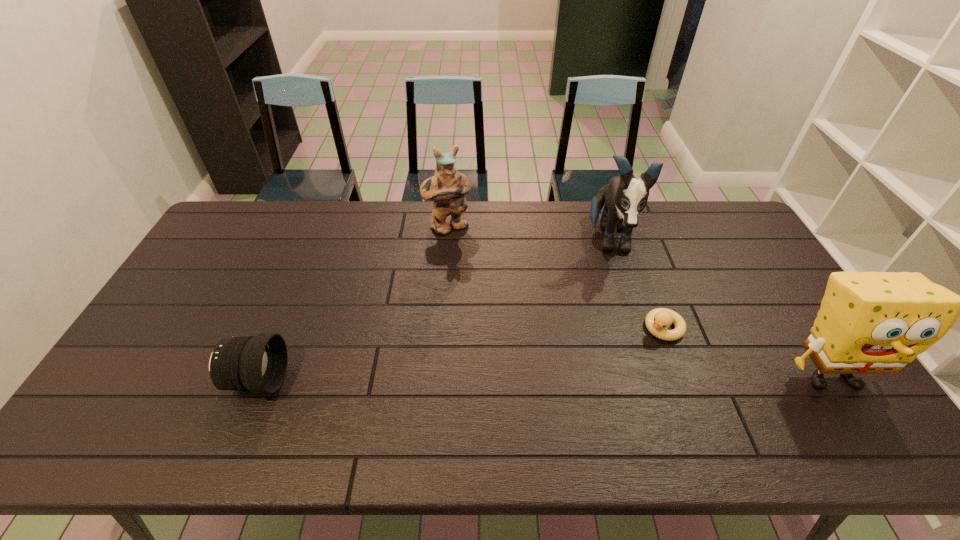
The width and height of the screenshot is (960, 540). Identify the location of vacant area located 0.200m at the beak of the shortest object. (606, 377).

You are a GUI agent. You are given a task and a screenshot of the screen. Output one action in this format:
    pyautogui.click(x=<x>, y=<y>)
    Task: Click on the free region located 0.160m on the front-facing side of the fourth object from right to left
    This screenshot has width=960, height=540.
    Given the screenshot: What is the action you would take?
    pyautogui.click(x=475, y=266)

Locate an element on the screen. Image resolution: width=960 pixels, height=540 pixels. vacant space located on the front-facing side of the fourth object from right to left is located at coordinates (508, 316).

Locate an element on the screen. This screenshot has height=540, width=960. vacant area located on the front-facing side of the fourth object from right to left is located at coordinates (475, 266).

Locate an element on the screen. The width and height of the screenshot is (960, 540). free point located 0.150m on the front-facing side of the puppy is located at coordinates (620, 310).

Locate an element on the screen. Image resolution: width=960 pixels, height=540 pixels. vacant region located on the front-facing side of the puppy is located at coordinates (621, 320).

Where is `vacant position located on the front-facing side of the puppy`? Image resolution: width=960 pixels, height=540 pixels. vacant position located on the front-facing side of the puppy is located at coordinates (619, 302).

This screenshot has width=960, height=540. In order to click on figurine that is positioned at the far edge in this screenshot , I will do `click(447, 187)`.

Where is `puppy located in the far edge section of the desktop`? Image resolution: width=960 pixels, height=540 pixels. puppy located in the far edge section of the desktop is located at coordinates (624, 197).

The height and width of the screenshot is (540, 960). Find the location of `telephoto lens that is positioned at the near edge`. telephoto lens that is positioned at the near edge is located at coordinates (258, 364).